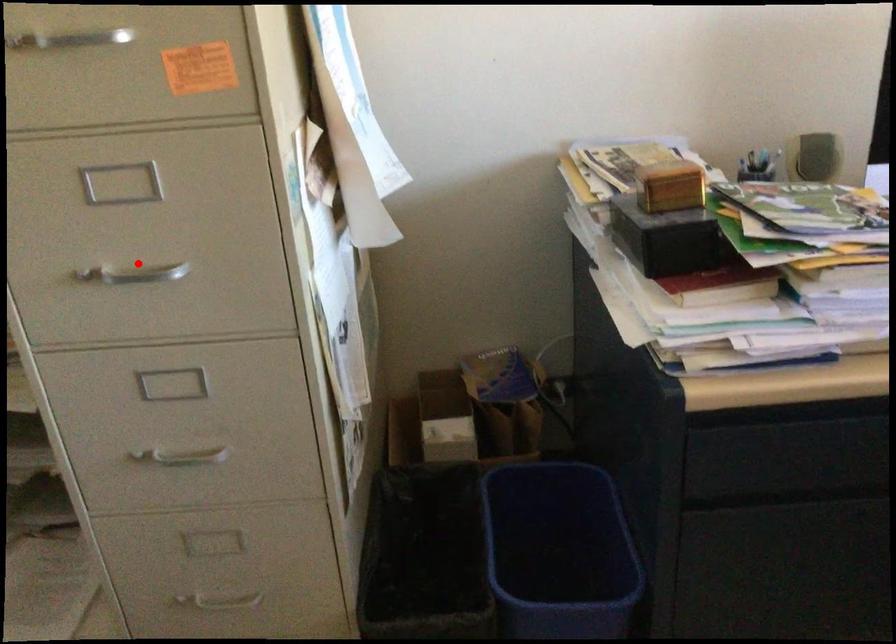
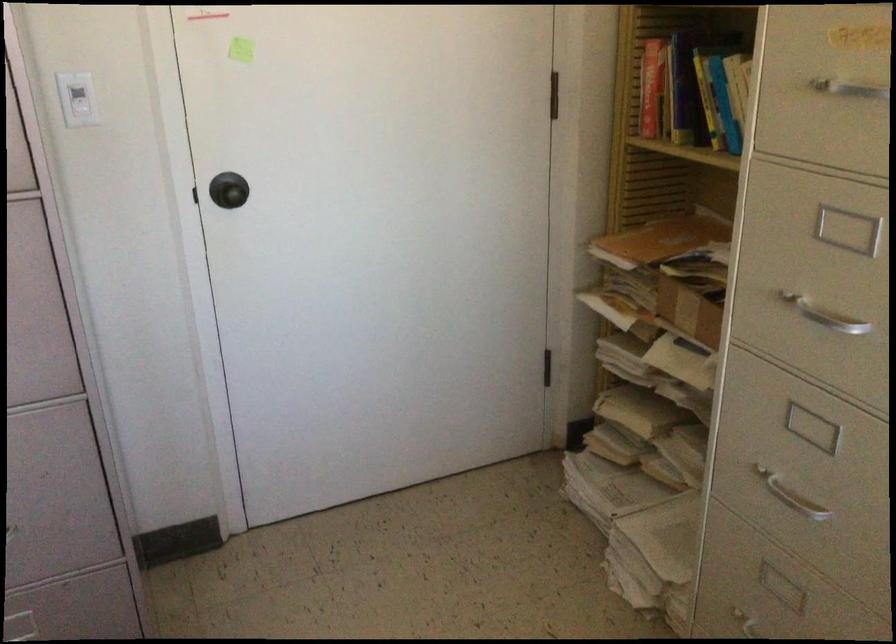
Find the pixel in the second image that matches the highlighted location in the first image.

(824, 315)